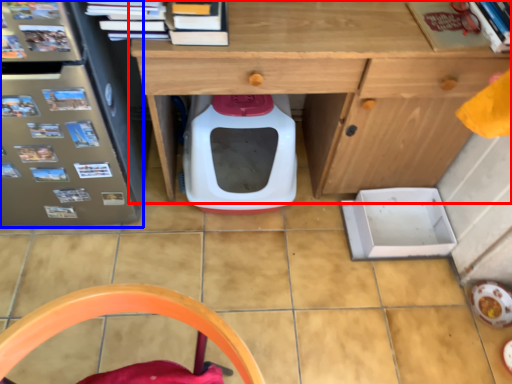
Question: Which object appears closest to the camera in this image, desk (highlighted by a red box) or fridge (highlighted by a blue box)?

Choices:
 (A) desk
 (B) fridge

Answer: (B)